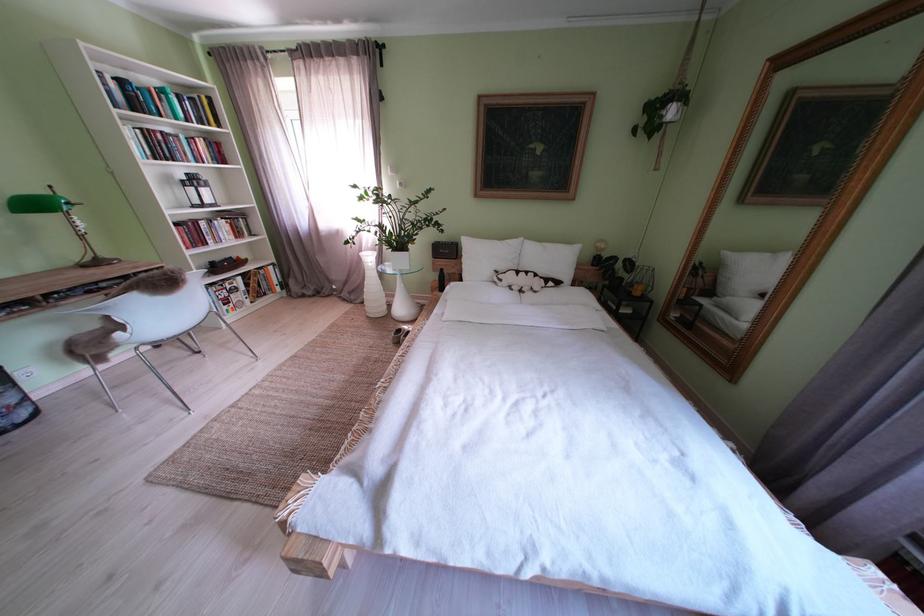
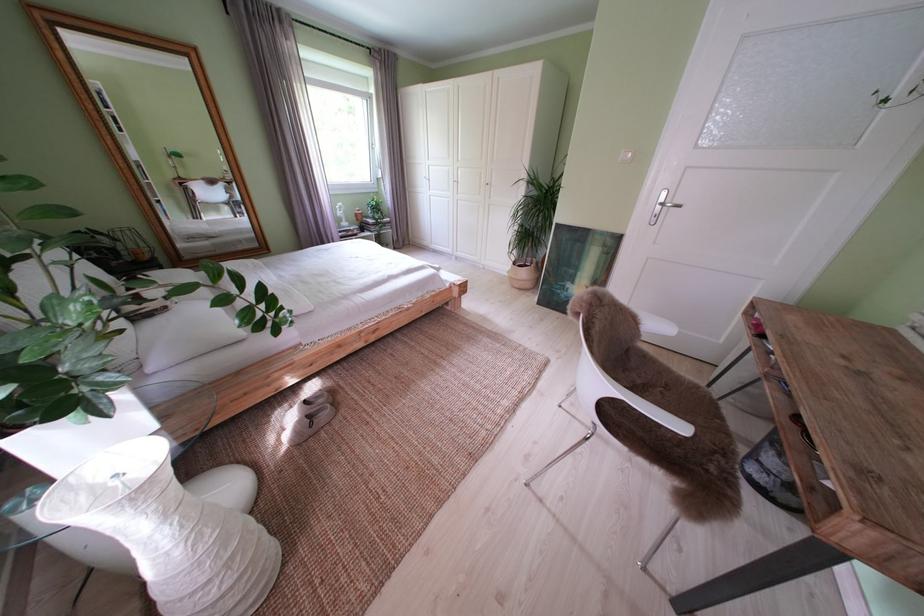
In the second image, find the point that corresponds to point (405, 256) in the first image.

(112, 395)